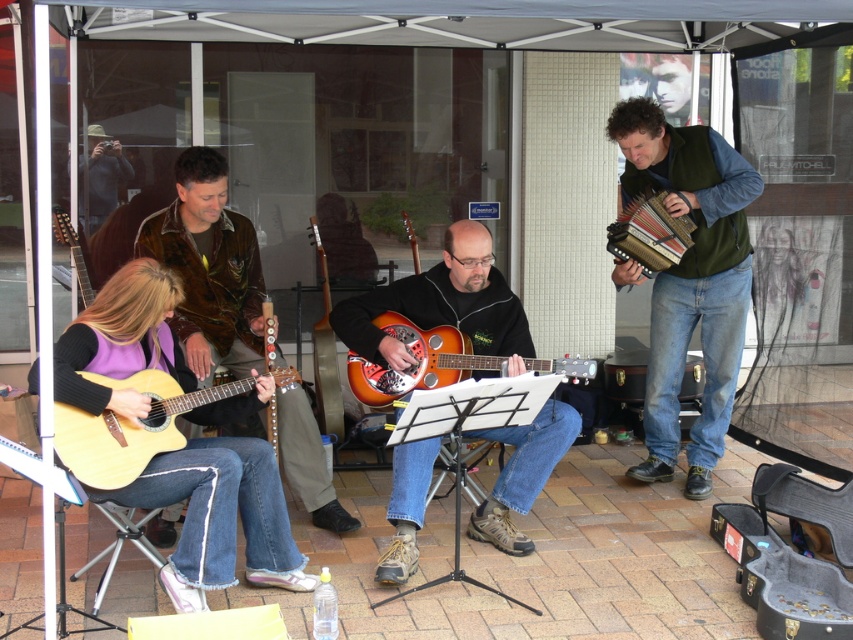
Which is more to the left, leather jacket at center or matte wood guitar at left?

From the viewer's perspective, matte wood guitar at left appears more on the left side.

Is leather jacket at center bigger than matte wood guitar at left?

Indeed, leather jacket at center has a larger size compared to matte wood guitar at left.

Who is more forward, (312, 440) or (68, 278)?

Point (312, 440)

This screenshot has height=640, width=853. I want to click on leather jacket at center, so click(209, 268).

Is green fabric vest at right positioned behind orange glossy guitar at center?

Yes, it is.

Who is positioned more to the left, green fabric vest at right or orange glossy guitar at center?

orange glossy guitar at center is more to the left.

This screenshot has height=640, width=853. Find the location of `green fabric vest at right`. green fabric vest at right is located at coordinates (689, 280).

Is leather jacket at center closer to the viewer compared to sunburst wood resonator guitar at center?

No, it is behind sunburst wood resonator guitar at center.

Does leather jacket at center have a greater height compared to sunburst wood resonator guitar at center?

Correct, leather jacket at center is much taller as sunburst wood resonator guitar at center.

The width and height of the screenshot is (853, 640). What do you see at coordinates (209, 268) in the screenshot?
I see `leather jacket at center` at bounding box center [209, 268].

In order to click on leather jacket at center in this screenshot , I will do `click(209, 268)`.